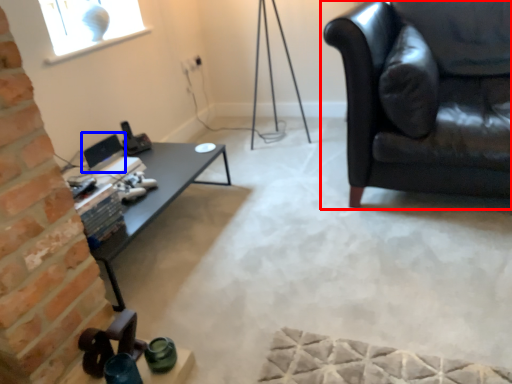
Question: Which object appears farthest to the camera in this image, studio couch (highlighted by a red box) or computer monitor (highlighted by a blue box)?

Choices:
 (A) studio couch
 (B) computer monitor

Answer: (B)